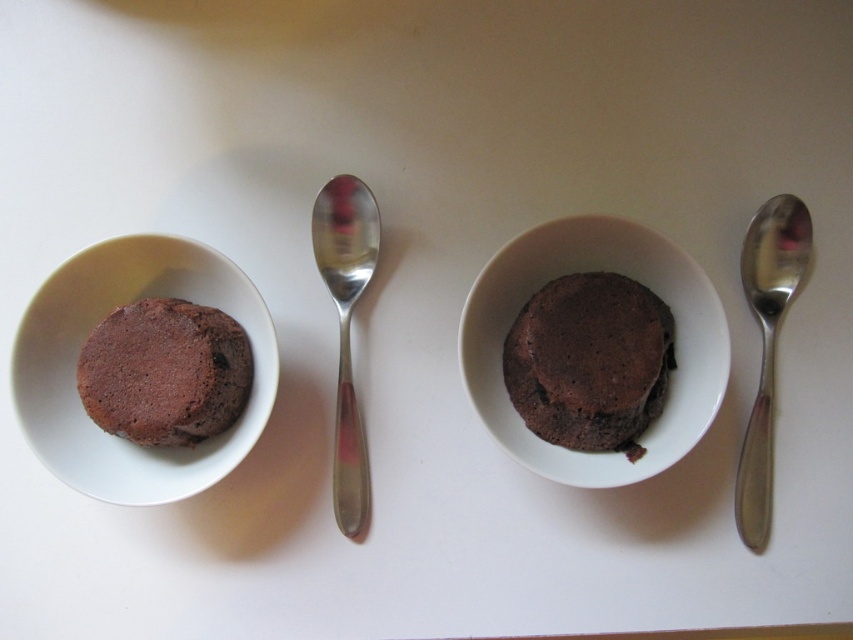
You are a dessert lover who wants to pick up the shiny silver spoon at center to taste the cake in the matte ceramic bowl at center. Can you reach the spoon without moving the bowl?

The matte ceramic bowl at center is bigger than the shiny silver spoon at center, so there is enough space around the bowl to reach the spoon without moving it.

Based on the coordinates provided, which object is located at point (596, 269)?

The matte ceramic bowl at center is located at point (596, 269) according to the coordinates provided.

You are a dessert lover who wants to eat the cake in the matte ceramic bowl at center. The shiny silver spoon at center is the only tool available. Can you reach the spoon without moving the bowl?

The distance between the matte ceramic bowl at center and the shiny silver spoon at center is 10.51 inches, so yes, you can reach the spoon without moving the bowl since the distance is sufficient.